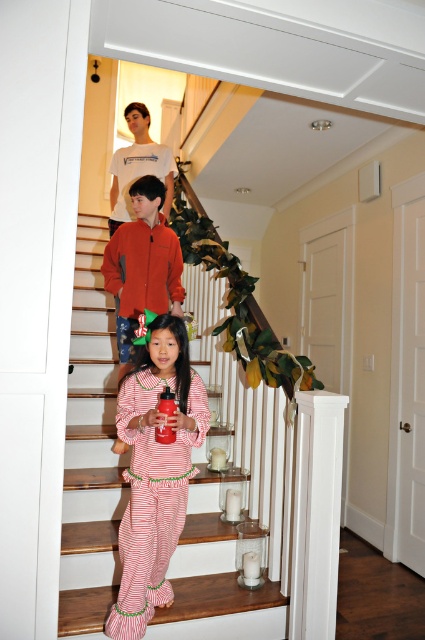
Which is above, red glossy water bottle at center or glossy plastic soda at center?

glossy plastic soda at center

Where is `red glossy water bottle at center`? The width and height of the screenshot is (425, 640). red glossy water bottle at center is located at coordinates point(90,449).

Image resolution: width=425 pixels, height=640 pixels. What do you see at coordinates (90, 449) in the screenshot?
I see `red glossy water bottle at center` at bounding box center [90, 449].

I want to click on red glossy water bottle at center, so click(90, 449).

Does red striped pajamas at center appear on the right side of glossy plastic soda at center?

In fact, red striped pajamas at center is to the left of glossy plastic soda at center.

Does point (135, 492) lie behind point (170, 403)?

Yes, it is.

Is point (129, 568) less distant than point (163, 401)?

No, (129, 568) is further to viewer.

I want to click on red striped pajamas at center, so click(155, 472).

Is point (121, 218) closer to camera compared to point (172, 392)?

No, (121, 218) is further to viewer.

Who is shorter, white t-shirt at upper center or glossy plastic soda at center?

With less height is glossy plastic soda at center.

Which is in front, point (172, 157) or point (175, 435)?

Point (175, 435) is more forward.

Identify the location of white t-shirt at upper center. (138, 166).